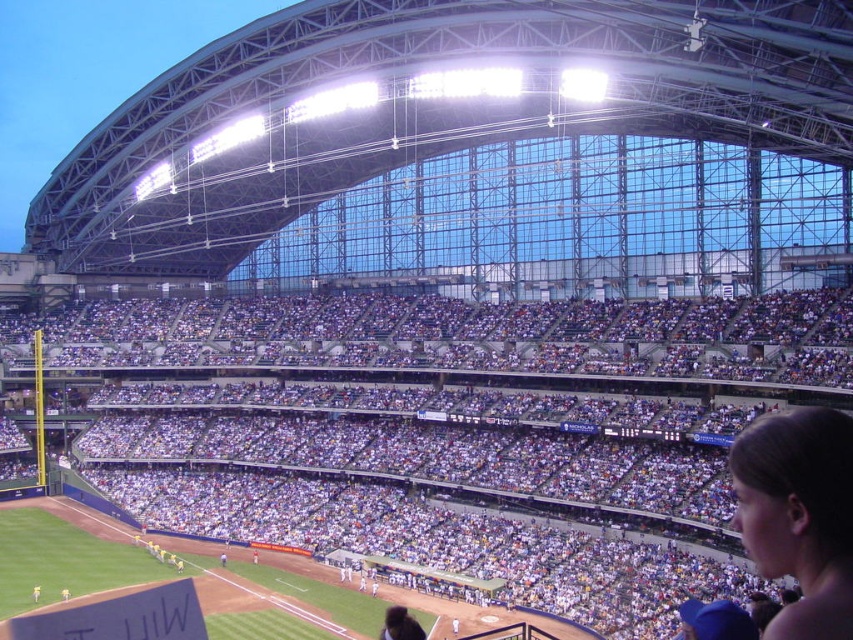
You are a photographer standing at the base of the stadium, looking up towards the stands. You notice the white fabric crowd at center and the brown hair at upper right. Which object is located more to the left when viewed from your perspective?

The white fabric crowd at center is positioned on the left side of brown hair at upper right, so it is more to the left when viewed from your perspective.

Based on the photo, you are a drone operator tasked with capturing aerial footage of the baseball stadium. You need to fly your drone from the point where the white fabric crowd is located at center to the point marked at coordinates point (421, 401). Is this possible without the drone crossing over any part of the curved roof?

The point at (421, 401) is where the white fabric crowd at center is located, so the drone is already at that point. Therefore, no flight is needed, and there is no risk of crossing the curved roof.

You are sitting in the stands of the baseball stadium and want to take a photo of both the point at coordinates [670,520] and the point at coordinates [804,515]. Which point should you focus on first to ensure both are in focus?

You should focus on the point at coordinates [670,520] first because it is closer to you than the point at coordinates [804,515], which is further away. This way, both points will be in focus when using a camera with a fixed focal length.